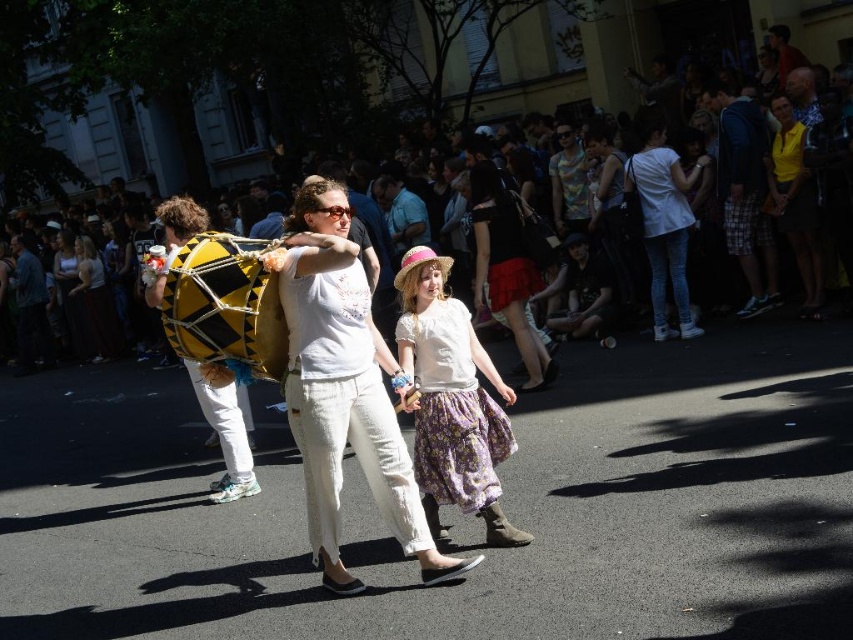
Question: Which of these objects is positioned farthest from the matte blue shirt at center?

Choices:
 (A) yellow/black drum at center
 (B) denim jacket at left

Answer: (B)

Question: Is white cotton shirt at center smaller than floral cotton skirt at center?

Choices:
 (A) yes
 (B) no

Answer: (B)

Question: Which point is farther to the camera?

Choices:
 (A) yellow smooth shirt at upper right
 (B) denim jacket at left

Answer: (B)

Question: Can you confirm if yellow/black drum at center is positioned below reddish-brown leather jacket at upper right?

Choices:
 (A) no
 (B) yes

Answer: (B)

Question: Is matte white blouse at center further to camera compared to reddish-brown leather jacket at upper right?

Choices:
 (A) yes
 (B) no

Answer: (A)

Question: Which object is positioned closest to the floral cotton skirt at center?

Choices:
 (A) dark blue hoodie at right
 (B) yellow/black drum at center
 (C) reddish-brown leather jacket at upper right

Answer: (B)